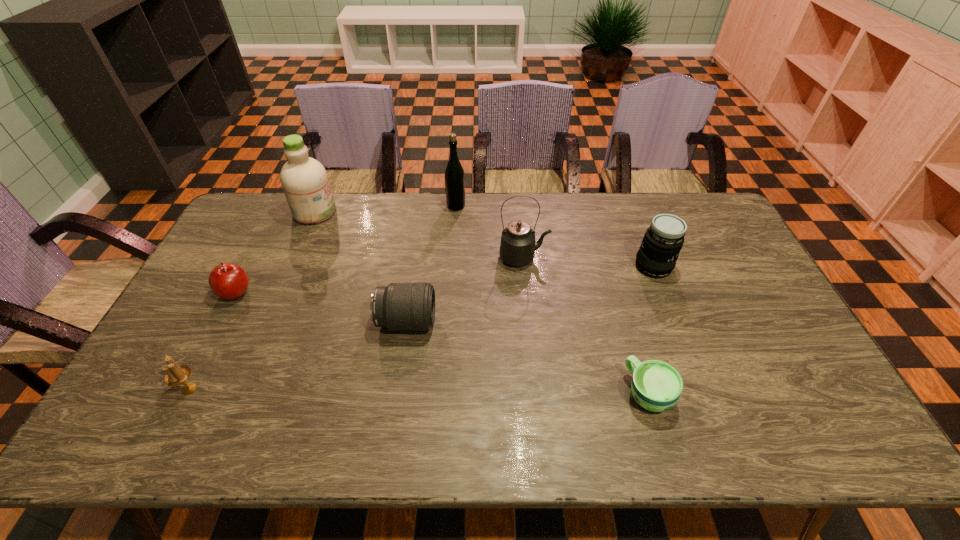
Locate an element on the screen. The width and height of the screenshot is (960, 540). the third object from left to right is located at coordinates (305, 183).

Identify the location of beer bottle. (454, 176).

What are the coordinates of `the sixth object from left to right` in the screenshot? It's located at (517, 248).

The image size is (960, 540). Find the location of `kettle`. kettle is located at coordinates (517, 248).

You are a GUI agent. You are given a task and a screenshot of the screen. Output one action in this format:
    pyautogui.click(x=<x>, y=<y>)
    Task: Click on the fourth tallest object
    The height and width of the screenshot is (540, 960).
    Given the screenshot: What is the action you would take?
    pyautogui.click(x=663, y=240)

In order to click on the farther telephoto lens in this screenshot , I will do `click(663, 240)`.

This screenshot has width=960, height=540. I want to click on candle holder, so click(175, 375).

You are a GUI agent. You are given a task and a screenshot of the screen. Output one action in this format:
    pyautogui.click(x=<x>, y=<y>)
    Task: Click on the nearer telephoto lens
    
    Given the screenshot: What is the action you would take?
    (399, 306)

At what (x,y) coordinates should I click in order to perform the action: click on the shorter telephoto lens. Please return your answer as a coordinate pair (x, y). This screenshot has height=540, width=960. Looking at the image, I should click on (399, 306).

Locate an element on the screen. apple is located at coordinates (227, 281).